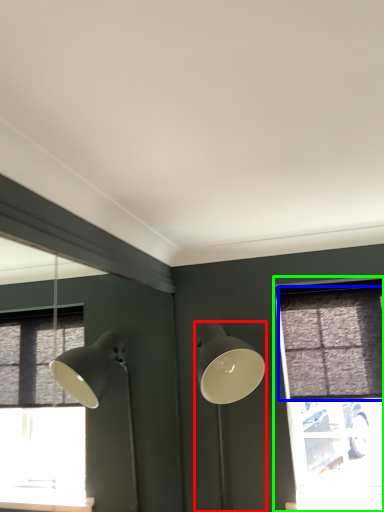
Question: Based on their relative distances, which object is farther from lamp (highlighted by a red box)? Choose from curtain (highlighted by a blue box) and window (highlighted by a green box).

Choices:
 (A) curtain
 (B) window

Answer: (B)